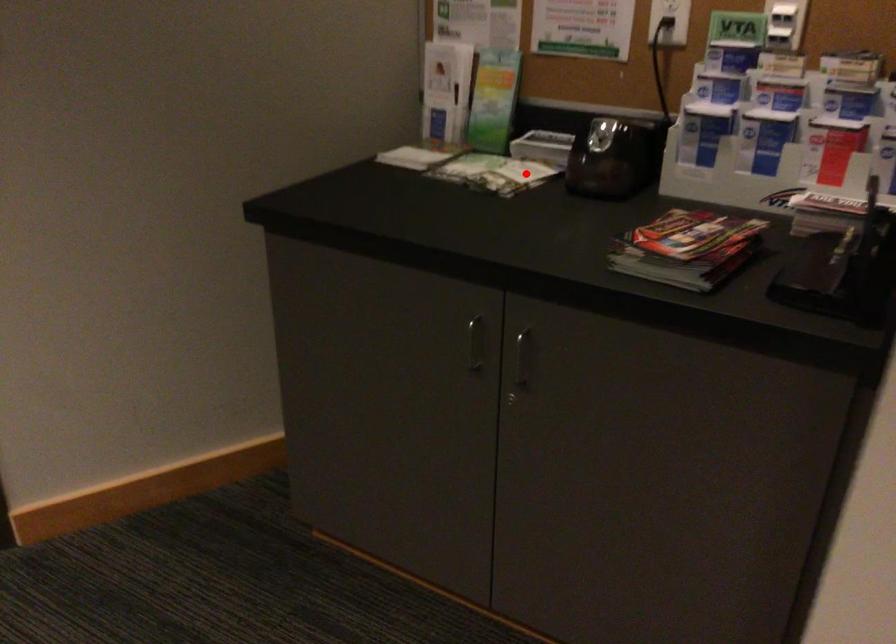
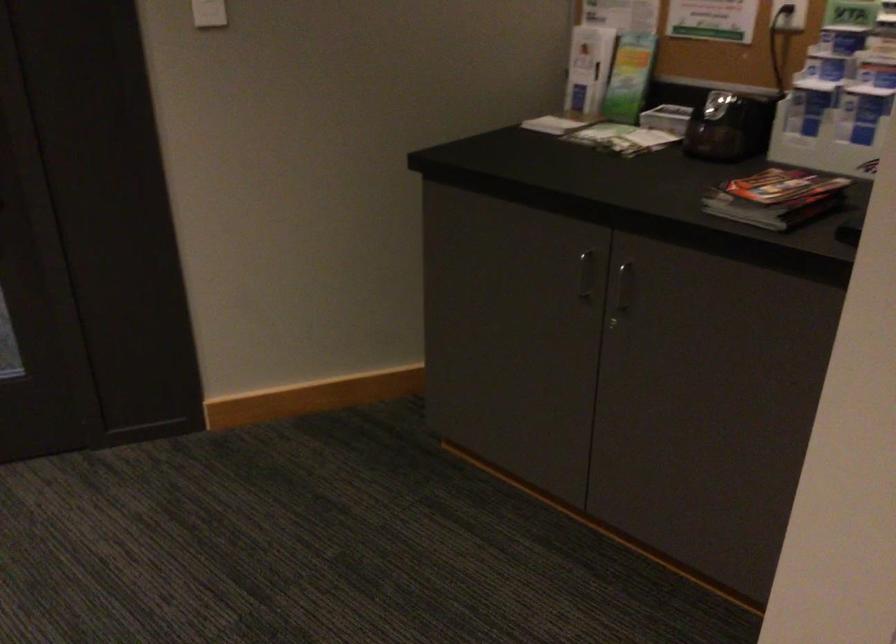
In the second image, find the point that corresponds to the highlighted location in the first image.

(647, 140)